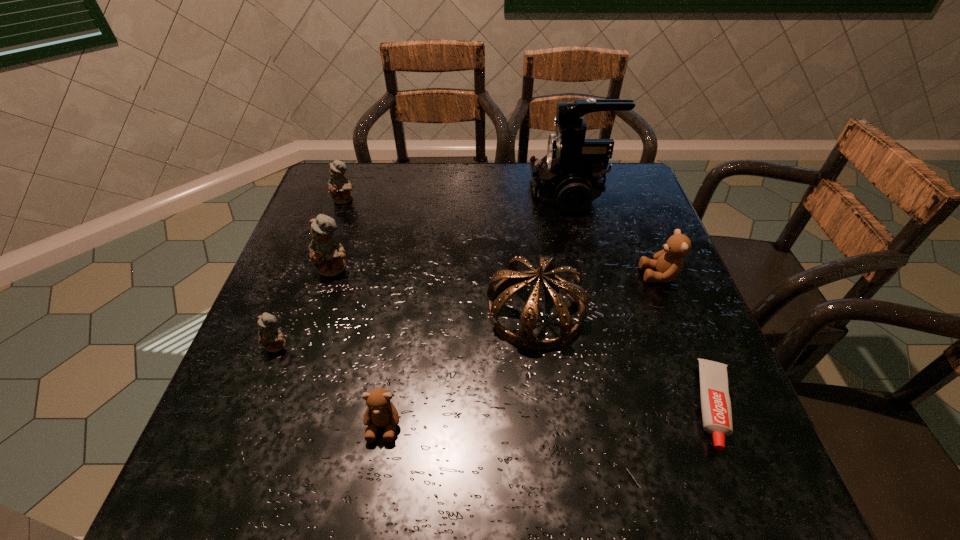
Locate an element on the screen. The width and height of the screenshot is (960, 540). camcorder is located at coordinates (571, 175).

Locate an element on the screen. The height and width of the screenshot is (540, 960). the second farthest blue teddy bear is located at coordinates (326, 254).

The image size is (960, 540). In order to click on the tallest teddy bear in this screenshot , I will do `click(326, 254)`.

The image size is (960, 540). In order to click on tiara in this screenshot , I will do `click(524, 337)`.

What are the coordinates of `the rightmost teddy bear` in the screenshot? It's located at (668, 263).

Identify the location of the bigger brown teddy bear. The width and height of the screenshot is (960, 540). (668, 263).

Find the location of `the second biggest blue teddy bear`. the second biggest blue teddy bear is located at coordinates (339, 188).

The height and width of the screenshot is (540, 960). I want to click on the farthest blue teddy bear, so click(339, 188).

Where is `the fourth farthest teddy bear`? the fourth farthest teddy bear is located at coordinates (271, 338).

The height and width of the screenshot is (540, 960). I want to click on the smallest blue teddy bear, so click(x=271, y=338).